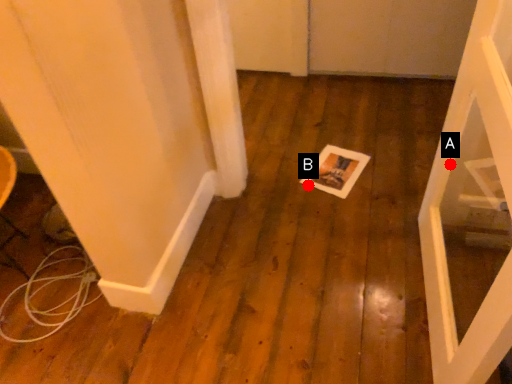
Question: Two points are circled on the image, labeled by A and B beside each circle. Which point is closer to the camera taking this photo?

Choices:
 (A) A is closer
 (B) B is closer

Answer: (A)